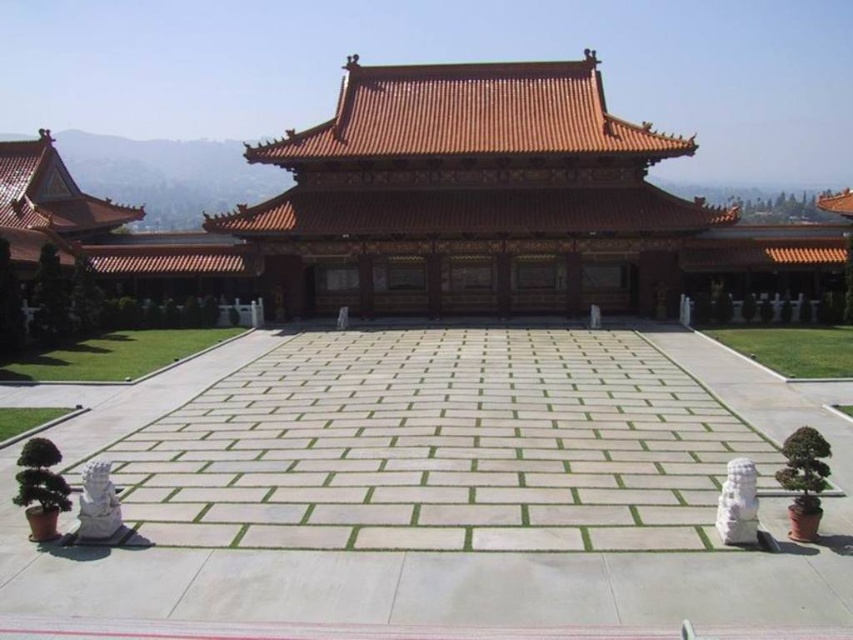
Is brown wooden palace at center positioned behind green grass at lower right?

Yes, brown wooden palace at center is behind green grass at lower right.

Is brown wooden palace at center below green grass at lower right?

No.

Is point (456, 266) more distant than point (846, 326)?

Yes.

At what (x,y) coordinates should I click in order to perform the action: click on brown wooden palace at center. Please return your answer as a coordinate pair (x, y). Looking at the image, I should click on (436, 209).

Which is more to the left, green grass at lower left or green grass at lower right?

green grass at lower left

I want to click on green grass at lower left, so click(x=115, y=355).

Can you confirm if brown wooden palace at center is wider than green leafy plant at lower left?

Yes.

You are a GUI agent. You are given a task and a screenshot of the screen. Output one action in this format:
    pyautogui.click(x=<x>, y=<y>)
    Task: Click on the brown wooden palace at center
    This screenshot has width=853, height=640.
    Given the screenshot: What is the action you would take?
    pyautogui.click(x=436, y=209)